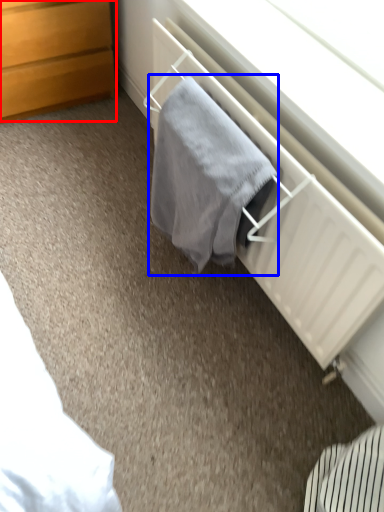
Question: Which object appears farthest to the camera in this image, chest of drawers (highlighted by a red box) or bath towel (highlighted by a blue box)?

Choices:
 (A) chest of drawers
 (B) bath towel

Answer: (A)